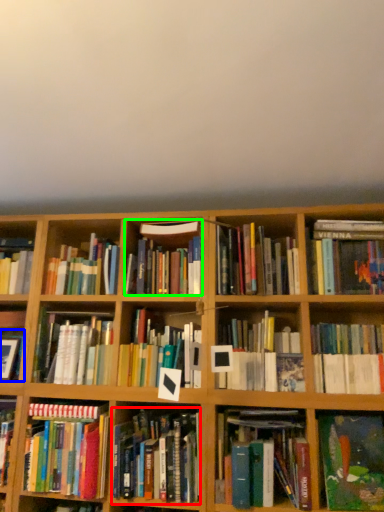
Question: Estimate the real-world distances between objects in this image. Which object is farther from book (highlighted by a red box), book (highlighted by a blue box) or book (highlighted by a green box)?

Choices:
 (A) book
 (B) book

Answer: (A)